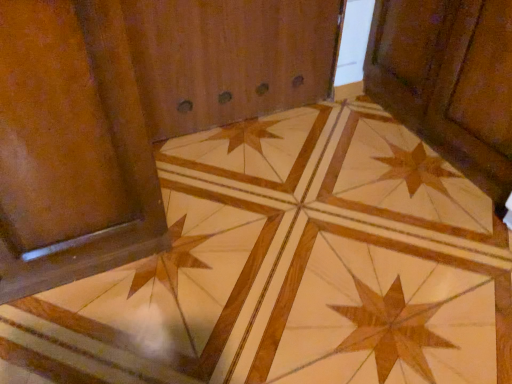
At what (x,y) coordinates should I click in order to perform the action: click on wooden door at center. Please return your answer as a coordinate pair (x, y). Looking at the image, I should click on (449, 80).

What do you see at coordinates (449, 80) in the screenshot? This screenshot has height=384, width=512. I see `wooden door at center` at bounding box center [449, 80].

Identify the location of wooden door at center. This screenshot has height=384, width=512. (449, 80).